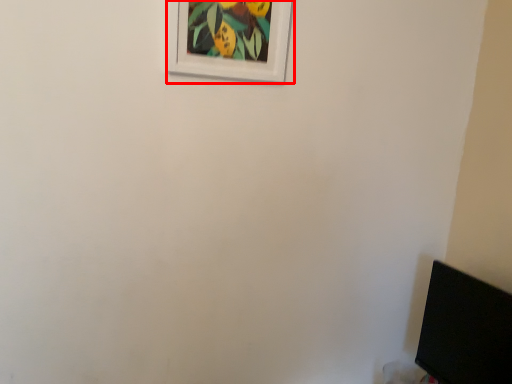
Question: From the image's perspective, considering the relative positions of picture frame (annotated by the red box) and computer monitor in the image provided, where is picture frame (annotated by the red box) located with respect to the staircase?

Choices:
 (A) above
 (B) below

Answer: (A)